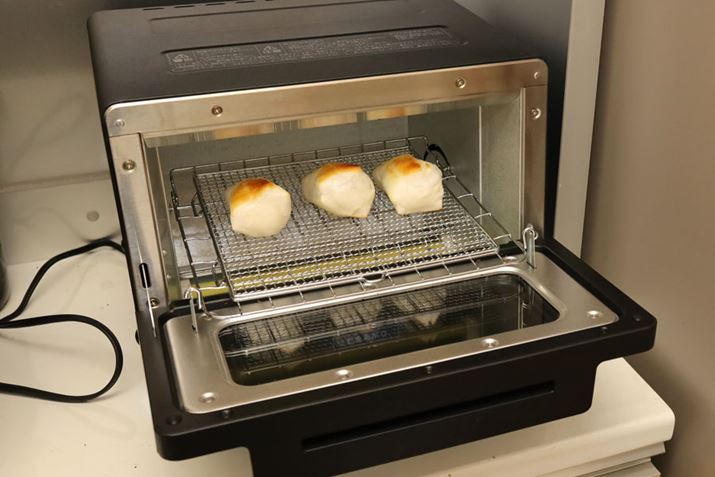
The image size is (715, 477). Identify the location of steel hinge. (147, 300).